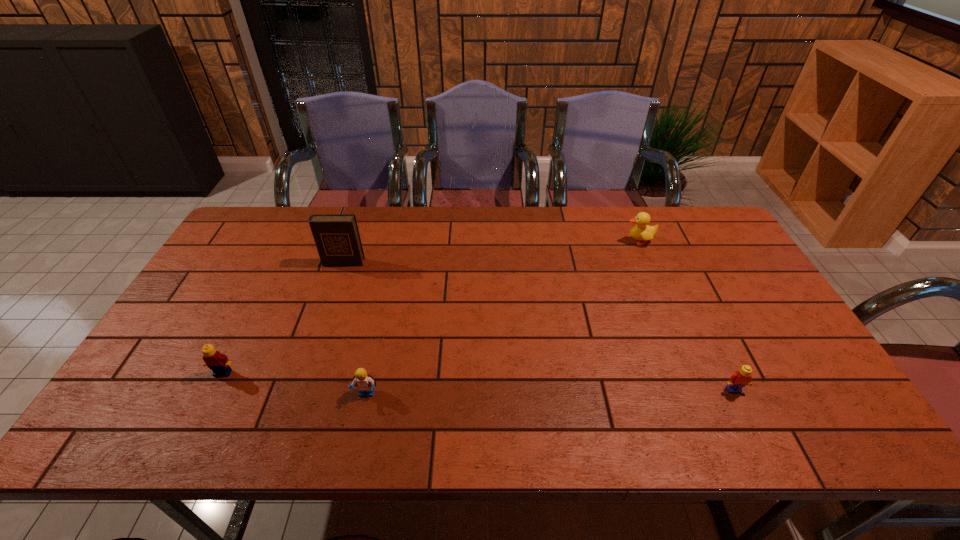
Locate an element on the screen. The image size is (960, 540). vacant region located on the front-facing side of the farthest object is located at coordinates (569, 241).

Image resolution: width=960 pixels, height=540 pixels. Identify the location of vacant region located on the front-facing side of the farthest Lego. (194, 431).

Locate an element on the screen. The image size is (960, 540). free location located 0.060m on the front-facing side of the rightmost Lego is located at coordinates (747, 417).

The image size is (960, 540). Identify the location of object present at the far edge. (642, 231).

In the image, there is a desktop. Where is `vacant region at the far edge`? vacant region at the far edge is located at coordinates (623, 238).

At what (x,y) coordinates should I click in order to perform the action: click on vacant space at the near edge. Please return your answer as a coordinate pair (x, y). Looking at the image, I should click on (686, 443).

Image resolution: width=960 pixels, height=540 pixels. I want to click on vacant space at the left edge of the desktop, so click(x=228, y=313).

Identify the location of vacant point at the right edge. (757, 295).

Locate an element on the screen. vacant space at the near left corner of the desktop is located at coordinates (172, 413).

This screenshot has width=960, height=540. What are the coordinates of `vacant space at the near right corner of the desktop` in the screenshot? It's located at (775, 411).